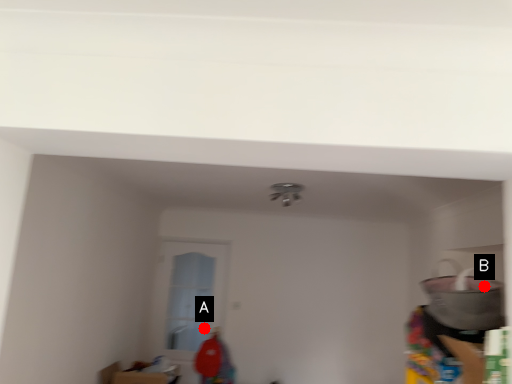
Question: Two points are circled on the image, labeled by A and B beside each circle. Which of the following is the farthest from the observer?

Choices:
 (A) A is further
 (B) B is further

Answer: (A)